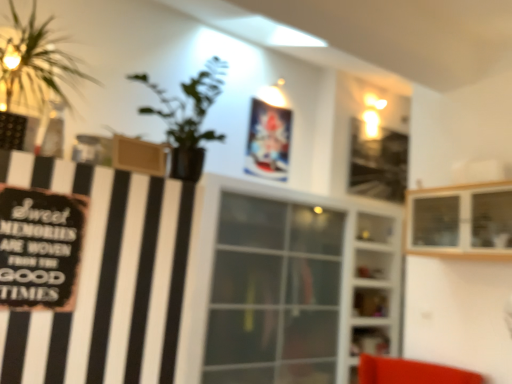
The height and width of the screenshot is (384, 512). In order to click on wooden cabinet at upper right, placed as the first shelf when sorted from top to bottom in this screenshot , I will do `click(460, 220)`.

What do you see at coordinates (274, 292) in the screenshot? I see `transparent glass window at center` at bounding box center [274, 292].

Where is `transparent glass window at center`? The height and width of the screenshot is (384, 512). transparent glass window at center is located at coordinates (274, 292).

Identify the location of green leafy plant at left. (31, 75).

The height and width of the screenshot is (384, 512). Find the location of `wooden cabinet at upper right, the second shelf ordered from the bottom`. wooden cabinet at upper right, the second shelf ordered from the bottom is located at coordinates (460, 220).

Which of these two, wooden cabinet at upper right, the second shelf ordered from the bottom, or transparent glass window at center, stands shorter?

wooden cabinet at upper right, the second shelf ordered from the bottom.

Which is behind, point (445, 194) or point (320, 322)?

The point (320, 322) is more distant.

Can we say wooden cabinet at upper right, the second shelf viewed from the back, lies outside transparent glass window at center?

Yes, wooden cabinet at upper right, the second shelf viewed from the back, is outside of transparent glass window at center.

Is green leafy plant at left to the left of black matte signboard at left from the viewer's perspective?

Yes, green leafy plant at left is to the left of black matte signboard at left.

From the image's perspective, is green leafy plant at left over black matte signboard at left?

Yes, from the image's perspective, green leafy plant at left is on top of black matte signboard at left.

Considering the sizes of green leafy plant at left and black matte signboard at left in the image, is green leafy plant at left wider or thinner than black matte signboard at left?

Clearly, green leafy plant at left has more width compared to black matte signboard at left.

Is green leafy plant at left aimed at wooden cabinet at upper right, the second shelf viewed from the back?

No, green leafy plant at left is not oriented towards wooden cabinet at upper right, the second shelf viewed from the back.

Who is taller, green leafy plant at left or wooden cabinet at upper right, the 1th shelf viewed from the front?

Standing taller between the two is green leafy plant at left.

How distant is green leafy plant at left from wooden cabinet at upper right, placed as the first shelf when sorted from top to bottom?

green leafy plant at left is 2.19 meters away from wooden cabinet at upper right, placed as the first shelf when sorted from top to bottom.

Locate an element on the screen. The width and height of the screenshot is (512, 384). houseplant that is above the wooden cabinet at upper right, the 1th shelf viewed from the front (from a real-world perspective) is located at coordinates (31, 75).

Does point (234, 271) lie in front of point (56, 268)?

No, (234, 271) is further to viewer.

Is transparent glass window at center far away from black matte signboard at left?

transparent glass window at center is positioned a significant distance from black matte signboard at left.

Based on the photo, how different are the orientations of transparent glass window at center and black matte signboard at left in degrees?

0.243 degrees separate the facing orientations of transparent glass window at center and black matte signboard at left.

From a real-world perspective, is transparent glass window at center physically above black matte signboard at left?

No.

Which of these two, transparent glass window at center or wooden cabinet at upper right, placed as the first shelf when sorted from top to bottom, stands taller?

With more height is transparent glass window at center.

Considering the relative positions of transparent glass window at center and wooden cabinet at upper right, the 1th shelf viewed from the front, in the image provided, is transparent glass window at center to the left of wooden cabinet at upper right, the 1th shelf viewed from the front, from the viewer's perspective?

Indeed, transparent glass window at center is positioned on the left side of wooden cabinet at upper right, the 1th shelf viewed from the front.

Is transparent glass window at center spatially inside wooden cabinet at upper right, placed as the first shelf when sorted from top to bottom, or outside of it?

transparent glass window at center lies outside wooden cabinet at upper right, placed as the first shelf when sorted from top to bottom.

Is transparent glass window at center wider than wooden cabinet at upper right, the second shelf ordered from the bottom?

Indeed, transparent glass window at center has a greater width compared to wooden cabinet at upper right, the second shelf ordered from the bottom.

From a real-world perspective, does wooden cabinet at upper right, placed as the first shelf when sorted from top to bottom, sit lower than black matte signboard at left?

No, from a real-world perspective, wooden cabinet at upper right, placed as the first shelf when sorted from top to bottom, is not under black matte signboard at left.

Is wooden cabinet at upper right, placed as the first shelf when sorted from top to bottom, to the left or to the right of black matte signboard at left in the image?

In the image, wooden cabinet at upper right, placed as the first shelf when sorted from top to bottom, appears on the right side of black matte signboard at left.

Considering the sizes of wooden cabinet at upper right, the 1th shelf viewed from the front, and black matte signboard at left in the image, is wooden cabinet at upper right, the 1th shelf viewed from the front, bigger or smaller than black matte signboard at left?

Considering their sizes, wooden cabinet at upper right, the 1th shelf viewed from the front, takes up more space than black matte signboard at left.

From the image's perspective, is transparent glass shelves at center, marked as the second shelf in a top-to-bottom arrangement, below transparent glass window at center?

Indeed, from the image's perspective, transparent glass shelves at center, marked as the second shelf in a top-to-bottom arrangement, is shown beneath transparent glass window at center.

Which of these two, transparent glass shelves at center, the 1th shelf when ordered from back to front, or transparent glass window at center, stands taller?

Standing taller between the two is transparent glass window at center.

Where is `window on the left of transparent glass shelves at center, the 1th shelf when ordered from bottom to top`? window on the left of transparent glass shelves at center, the 1th shelf when ordered from bottom to top is located at coordinates (274, 292).

Which point is more distant from viewer, (346,328) or (263,218)?

The point (346,328) is farther.

I want to click on shelf above the transparent glass window at center (from the image's perspective), so click(x=460, y=220).

Image resolution: width=512 pixels, height=384 pixels. In order to click on houseplant lying in front of the black matte signboard at left in this screenshot , I will do `click(31, 75)`.

Considering their positions, is transparent glass shelves at center, the 1th shelf when ordered from back to front, positioned further to transparent glass window at center than green leafy plant at left?

Based on the image, green leafy plant at left appears to be further to transparent glass window at center.

Estimate the real-world distances between objects in this image. Which object is further from green leafy plant at left, transparent glass window at center or black matte signboard at left?

The object further to green leafy plant at left is transparent glass window at center.

From the image, which object appears to be nearer to transparent glass window at center, wooden cabinet at upper right, the second shelf viewed from the back, or black matte signboard at left?

Based on the image, wooden cabinet at upper right, the second shelf viewed from the back, appears to be nearer to transparent glass window at center.

Considering their positions, is transparent glass shelves at center, the 1th shelf when ordered from back to front, positioned further to black matte signboard at left than green leafy plant at left?

Among the two, transparent glass shelves at center, the 1th shelf when ordered from back to front, is located further to black matte signboard at left.

From the image, which object appears to be nearer to black matte signboard at left, transparent glass shelves at center, marked as the second shelf in a top-to-bottom arrangement, or transparent glass window at center?

transparent glass window at center is closer to black matte signboard at left.

Which object lies nearer to the anchor point green leafy plant at left, black matte signboard at left or wooden cabinet at upper right, the 1th shelf viewed from the front?

Based on the image, black matte signboard at left appears to be nearer to green leafy plant at left.

From the image, which object appears to be nearer to transparent glass window at center, green leafy plant at left or transparent glass shelves at center, which ranks as the 2th shelf in front-to-back order?

The object closer to transparent glass window at center is transparent glass shelves at center, which ranks as the 2th shelf in front-to-back order.

Looking at this image, estimate the real-world distances between objects in this image. Which object is closer to green leafy plant at left, transparent glass shelves at center, the 1th shelf when ordered from back to front, or wooden cabinet at upper right, the 1th shelf viewed from the front?

wooden cabinet at upper right, the 1th shelf viewed from the front, lies closer to green leafy plant at left than the other object.

This screenshot has width=512, height=384. Identify the location of shelf located between black matte signboard at left and transparent glass window at center in the depth direction. (460, 220).

Identify the location of window located between wooden cabinet at upper right, placed as the first shelf when sorted from top to bottom, and transparent glass shelves at center, marked as the second shelf in a top-to-bottom arrangement, in the depth direction. (274, 292).

Image resolution: width=512 pixels, height=384 pixels. Find the location of `window between black matte signboard at left and transparent glass shelves at center, marked as the second shelf in a top-to-bottom arrangement, in the front-back direction`. window between black matte signboard at left and transparent glass shelves at center, marked as the second shelf in a top-to-bottom arrangement, in the front-back direction is located at coordinates (274, 292).

Image resolution: width=512 pixels, height=384 pixels. Identify the location of writing positioned between green leafy plant at left and transparent glass shelves at center, the 1th shelf when ordered from back to front, from near to far. (38, 248).